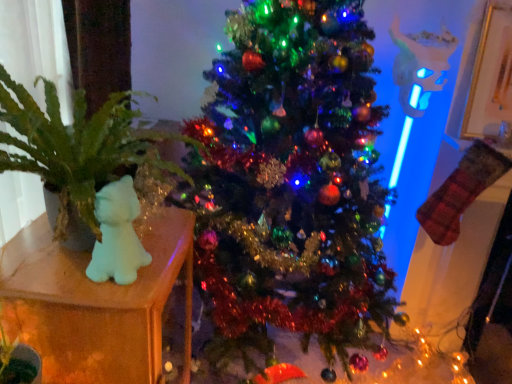
Question: Is translucent plastic bear at left oriented away from green leafy plant at left?

Choices:
 (A) no
 (B) yes

Answer: (A)

Question: From the image's perspective, is translucent plastic bear at left below green leafy plant at left?

Choices:
 (A) yes
 (B) no

Answer: (A)

Question: Does translucent plastic bear at left have a greater width compared to green leafy plant at left?

Choices:
 (A) no
 (B) yes

Answer: (A)

Question: Can you confirm if translucent plastic bear at left is positioned to the left of green leafy plant at left?

Choices:
 (A) yes
 (B) no

Answer: (A)

Question: Is translucent plastic bear at left taller than green leafy plant at left?

Choices:
 (A) no
 (B) yes

Answer: (B)

Question: Can you confirm if translucent plastic bear at left is positioned to the right of green leafy plant at left?

Choices:
 (A) no
 (B) yes

Answer: (A)

Question: Does translucent plastic bear at left turn towards shiny green christmas tree at center?

Choices:
 (A) no
 (B) yes

Answer: (A)

Question: Is translucent plastic bear at left to the left of shiny green christmas tree at center from the viewer's perspective?

Choices:
 (A) no
 (B) yes

Answer: (B)

Question: Is translucent plastic bear at left bigger than shiny green christmas tree at center?

Choices:
 (A) yes
 (B) no

Answer: (B)

Question: Are translucent plastic bear at left and shiny green christmas tree at center making contact?

Choices:
 (A) yes
 (B) no

Answer: (B)

Question: Is translucent plastic bear at left closer to the viewer compared to shiny green christmas tree at center?

Choices:
 (A) no
 (B) yes

Answer: (A)

Question: Does translucent plastic bear at left have a greater width compared to shiny green christmas tree at center?

Choices:
 (A) no
 (B) yes

Answer: (A)

Question: Is green leafy plant at left wider than shiny green christmas tree at center?

Choices:
 (A) no
 (B) yes

Answer: (A)